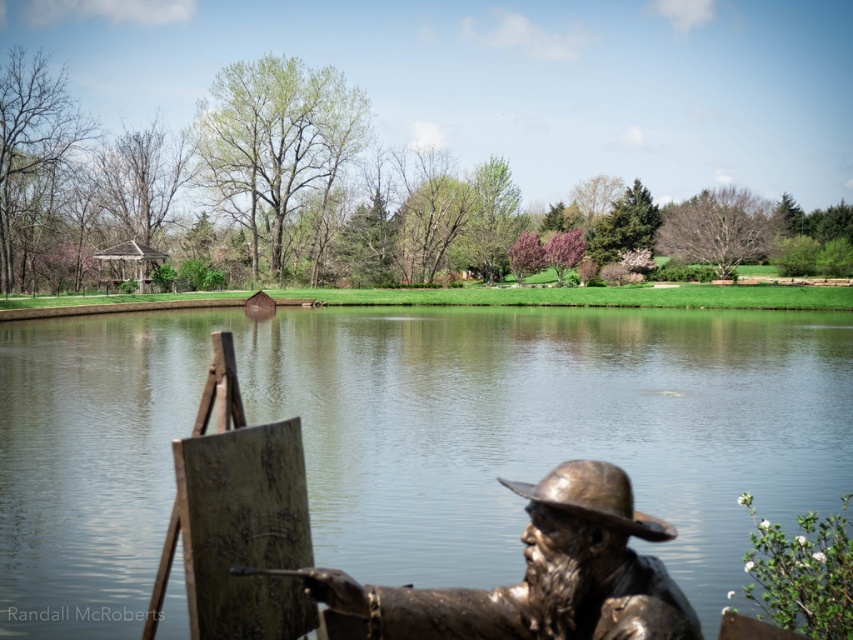
Can you confirm if clear water at center is wider than bronze statue at lower right?

Yes, clear water at center is wider than bronze statue at lower right.

Measure the distance between point [120,449] and camera.

Point [120,449] and camera are 17.48 meters apart from each other.

Measure the distance between point (712,588) and camera.

Point (712,588) is 36.26 feet from camera.

You are a GUI agent. You are given a task and a screenshot of the screen. Output one action in this format:
    pyautogui.click(x=<x>, y=<y>)
    Task: Click on the clear water at center
    Image resolution: width=853 pixels, height=640 pixels.
    Given the screenshot: What is the action you would take?
    pyautogui.click(x=413, y=438)